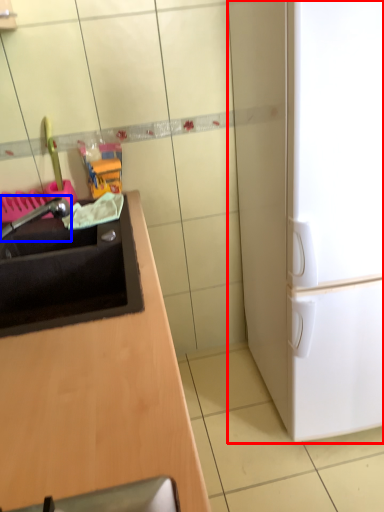
Question: Among these objects, which one is nearest to the camera, refrigerator (highlighted by a red box) or faucet (highlighted by a blue box)?

Choices:
 (A) refrigerator
 (B) faucet

Answer: (A)